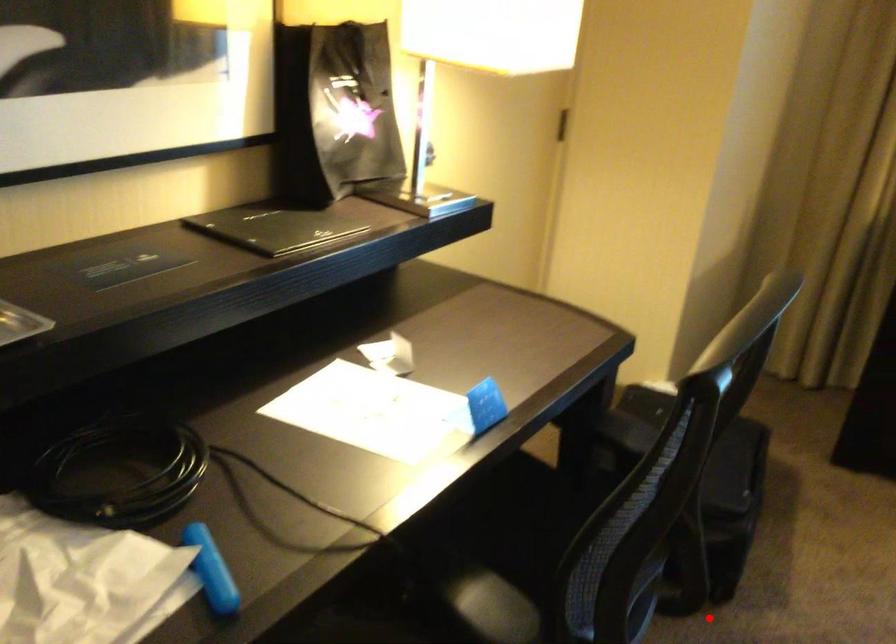
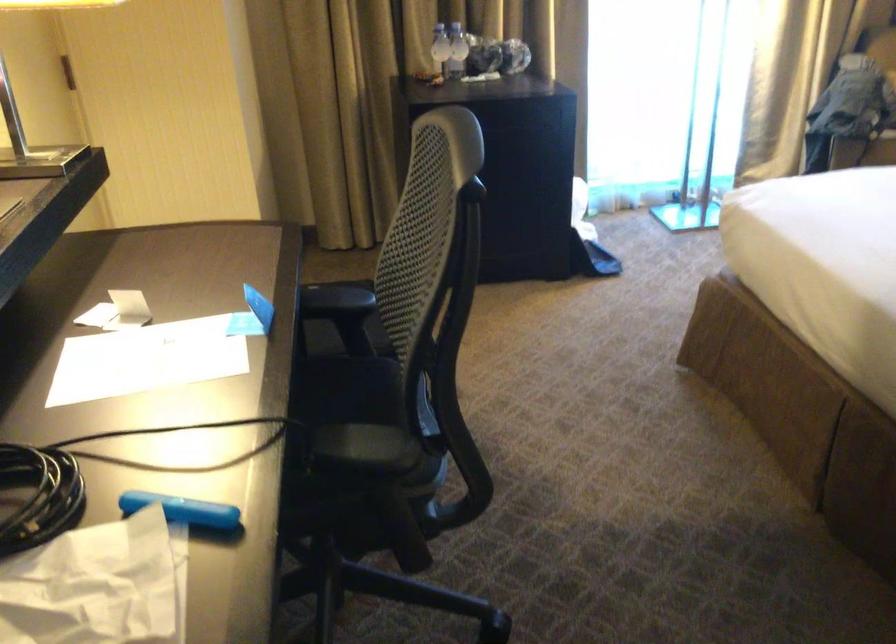
Question: I am providing you with two images of the same scene from different viewpoints. A red point is marked on the first image. Can you still see the location of the red point in image 2?

Choices:
 (A) Yes
 (B) No

Answer: (B)